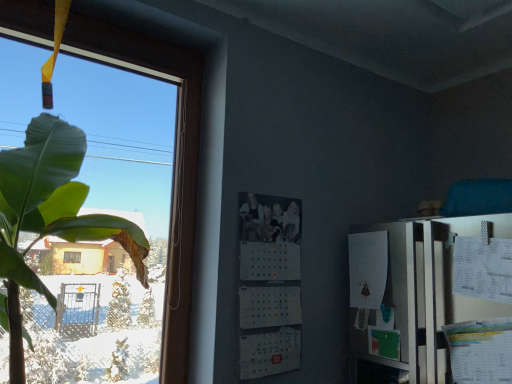
I want to click on transparent glass window at left, so click(x=182, y=155).

What do you see at coordinates (182, 155) in the screenshot? I see `transparent glass window at left` at bounding box center [182, 155].

This screenshot has height=384, width=512. What are the coordinates of `white matte calendar at center` in the screenshot? It's located at (269, 285).

Describe the element at coordinates (269, 285) in the screenshot. The width and height of the screenshot is (512, 384). I see `white matte calendar at center` at that location.

Image resolution: width=512 pixels, height=384 pixels. I want to click on transparent glass window at left, so click(x=182, y=155).

Between white matte calendar at center and transparent glass window at left, which one appears on the right side from the viewer's perspective?

From the viewer's perspective, white matte calendar at center appears more on the right side.

Which object is closer to the camera, white matte calendar at center or transparent glass window at left?

transparent glass window at left is in front.

Which is closer to the camera, (246, 299) or (132, 67)?

Point (246, 299)

From the image's perspective, which one is positioned higher, white matte calendar at center or transparent glass window at left?

From the image's view, transparent glass window at left is above.

From a real-world perspective, which object rests below the other?

In real-world perspective, white matte calendar at center is lower.

Considering the sizes of objects white matte calendar at center and transparent glass window at left in the image provided, who is wider, white matte calendar at center or transparent glass window at left?

Wider between the two is transparent glass window at left.

Can you confirm if white matte calendar at center is shorter than transparent glass window at left?

Yes, white matte calendar at center is shorter than transparent glass window at left.

Based on their sizes in the image, would you say white matte calendar at center is bigger or smaller than transparent glass window at left?

white matte calendar at center is smaller than transparent glass window at left.

Would you say white matte calendar at center contains transparent glass window at left?

No, transparent glass window at left is located outside of white matte calendar at center.

Is white matte calendar at center next to transparent glass window at left and touching it?

No.

Is white matte calendar at center looking in the opposite direction of transparent glass window at left?

That's not correct — white matte calendar at center is not looking away from transparent glass window at left.

What's the angular difference between white matte calendar at center and transparent glass window at left's facing directions?

The angular difference between white matte calendar at center and transparent glass window at left is 0.0794 degrees.

How distant is white matte calendar at center from transparent glass window at left?

white matte calendar at center is 14.23 inches away from transparent glass window at left.

You are a GUI agent. You are given a task and a screenshot of the screen. Output one action in this format:
    pyautogui.click(x=<x>, y=<y>)
    Task: Click on the bulletin board that is below the transparent glass window at left (from the image's perspective)
    
    Given the screenshot: What is the action you would take?
    pyautogui.click(x=269, y=285)

Visually, is transparent glass window at left positioned to the left or to the right of white matte calendar at center?

Based on their positions, transparent glass window at left is located to the left of white matte calendar at center.

Is transparent glass window at left closer to camera compared to white matte calendar at center?

Yes, it is.

Between point (193, 126) and point (244, 276), which one is positioned behind?

Point (193, 126)

From the image's perspective, is transparent glass window at left positioned above or below white matte calendar at center?

From the image's perspective, transparent glass window at left appears above white matte calendar at center.

From a real-world perspective, does transparent glass window at left stand above white matte calendar at center?

Yes, from a real-world perspective, transparent glass window at left is over white matte calendar at center

In terms of width, does transparent glass window at left look wider or thinner when compared to white matte calendar at center?

transparent glass window at left is wider than white matte calendar at center.

In terms of height, does transparent glass window at left look taller or shorter compared to white matte calendar at center?

In the image, transparent glass window at left appears to be taller than white matte calendar at center.

Considering the sizes of objects transparent glass window at left and white matte calendar at center in the image provided, who is bigger, transparent glass window at left or white matte calendar at center?

Bigger between the two is transparent glass window at left.

Would you say transparent glass window at left is inside or outside white matte calendar at center?

transparent glass window at left lies outside white matte calendar at center.

Would you say transparent glass window at left is a long distance from white matte calendar at center?

No, transparent glass window at left is not far from white matte calendar at center.

Is transparent glass window at left facing away from white matte calendar at center?

No.

Identify the location of window above the white matte calendar at center (from the image's perspective). (182, 155).

Find the location of a particular element. Image resolution: width=512 pixels, height=384 pixels. window above the white matte calendar at center (from the image's perspective) is located at coordinates (182, 155).

Where is `bulletin board behind the transparent glass window at left`? The image size is (512, 384). bulletin board behind the transparent glass window at left is located at coordinates (269, 285).